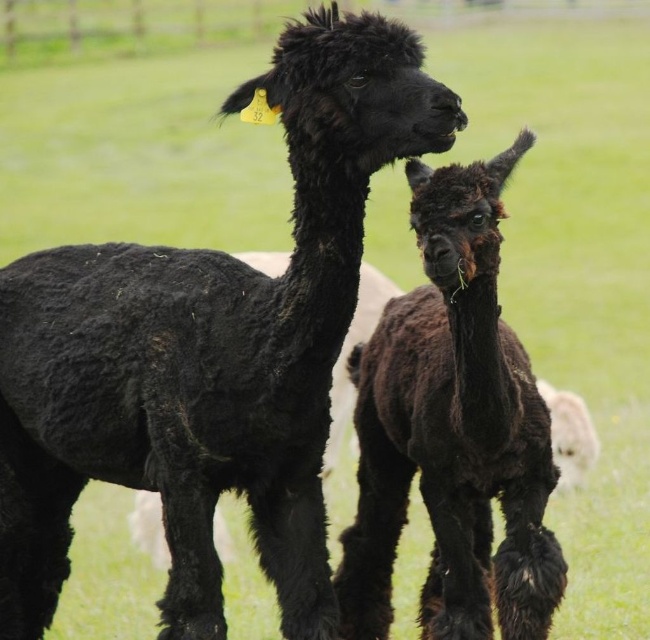
Question: Among these objects, which one is nearest to the camera?

Choices:
 (A) shiny black alpaca at center
 (B) black woolly alpaca at left

Answer: (B)

Question: Is black woolly alpaca at left positioned before shiny black alpaca at center?

Choices:
 (A) no
 (B) yes

Answer: (B)

Question: Which of the following is the closest to the observer?

Choices:
 (A) black woolly alpaca at left
 (B) shiny black alpaca at center

Answer: (A)

Question: Can you confirm if black woolly alpaca at left is positioned to the right of shiny black alpaca at center?

Choices:
 (A) yes
 (B) no

Answer: (B)

Question: Does black woolly alpaca at left appear on the left side of shiny black alpaca at center?

Choices:
 (A) no
 (B) yes

Answer: (B)